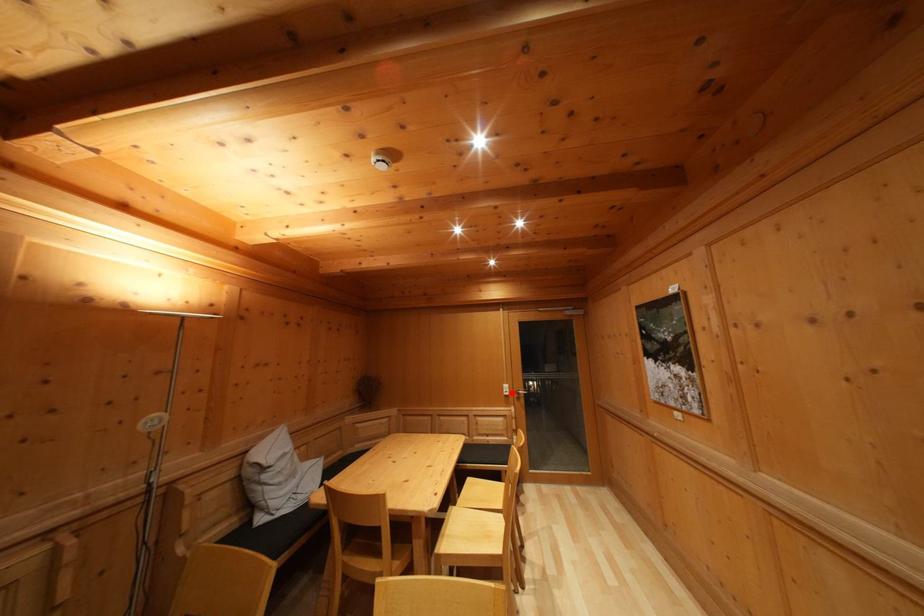
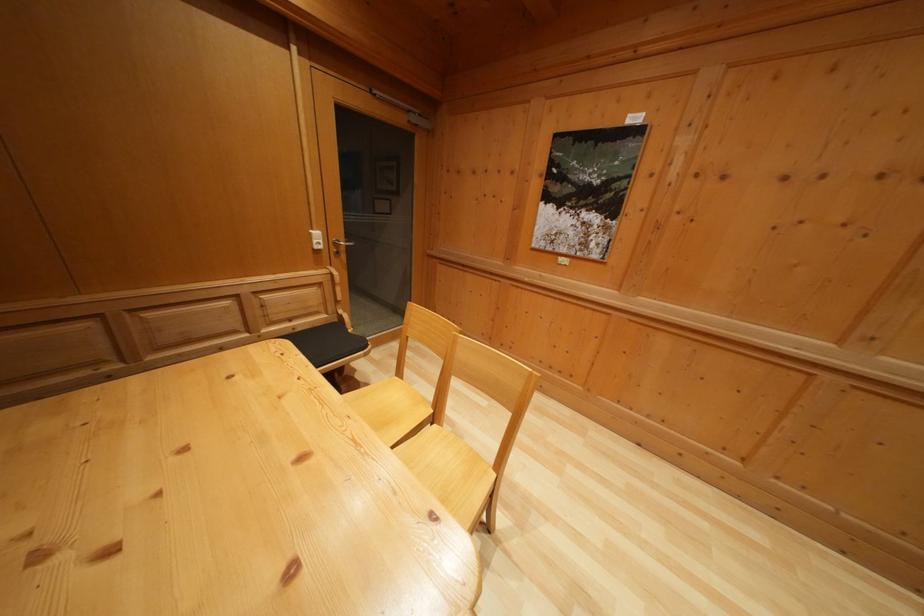
Locate, in the second image, the point that corresponds to the highlighted location in the first image.

(322, 240)